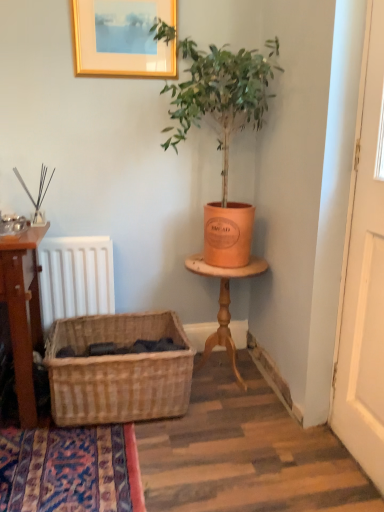
Identify the location of vacant space in front of wooden table at right. The height and width of the screenshot is (512, 384). (244, 416).